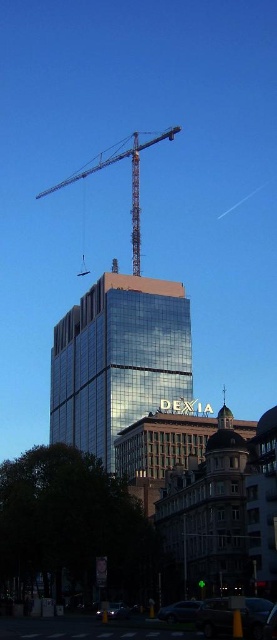
Question: Does metallic silver car at lower right appear under metallic gray crane at upper center?

Choices:
 (A) no
 (B) yes

Answer: (B)

Question: Which point is closer to the camera taking this photo?

Choices:
 (A) (111, 612)
 (B) (198, 600)

Answer: (A)

Question: Which point is farther to the camera?

Choices:
 (A) (65, 182)
 (B) (98, 616)
 (C) (180, 381)
 (D) (258, 628)

Answer: (A)

Question: Is shiny glass tower at center wider than shiny black car at lower center?

Choices:
 (A) no
 (B) yes

Answer: (B)

Question: Is metallic silver car at lower right to the right of metallic gray crane at upper center from the viewer's perspective?

Choices:
 (A) yes
 (B) no

Answer: (A)

Question: Which object is the closest to the metallic gray crane at upper center?

Choices:
 (A) metallic silver car at lower center
 (B) metallic silver car at lower right
 (C) shiny glass tower at center

Answer: (C)